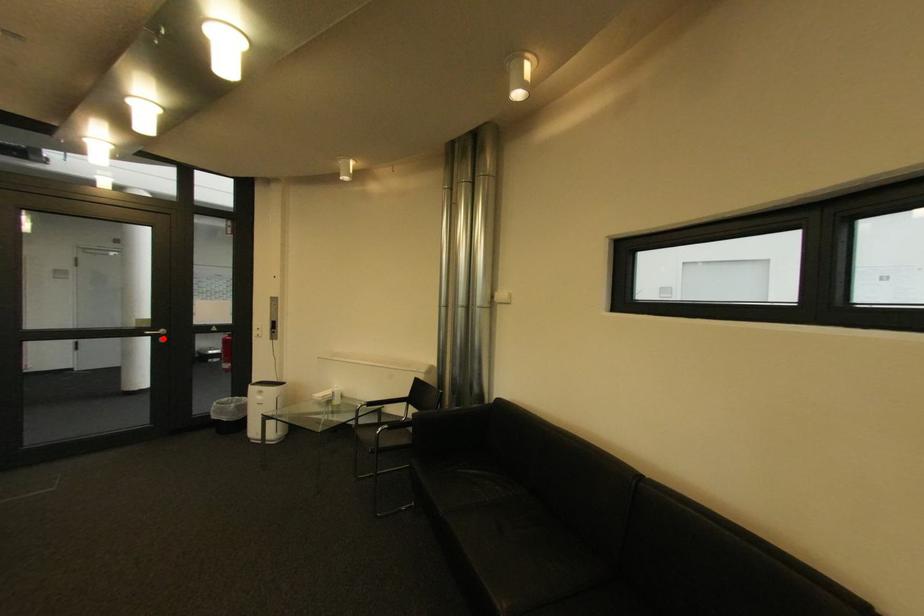
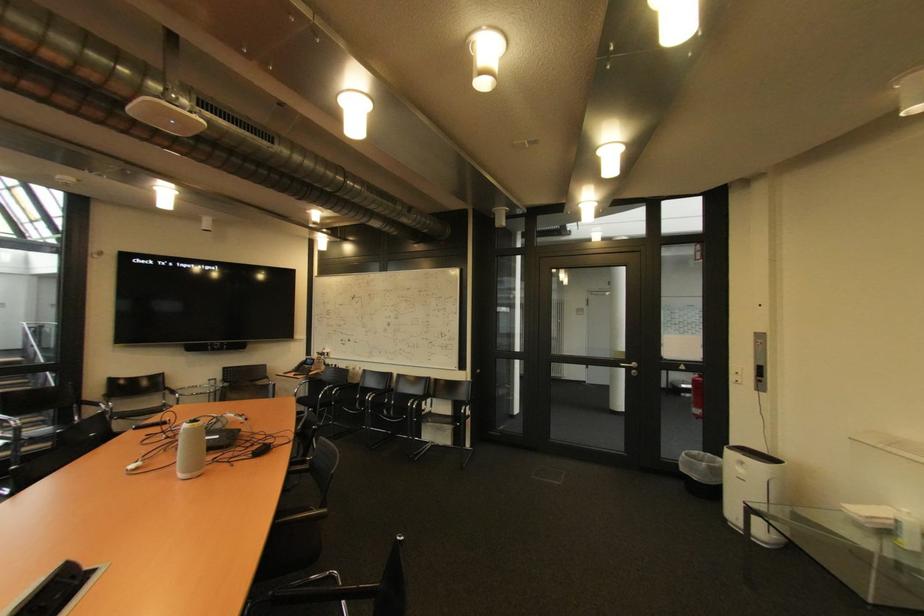
In the second image, find the point that corresponds to the highlighted location in the first image.

(637, 371)